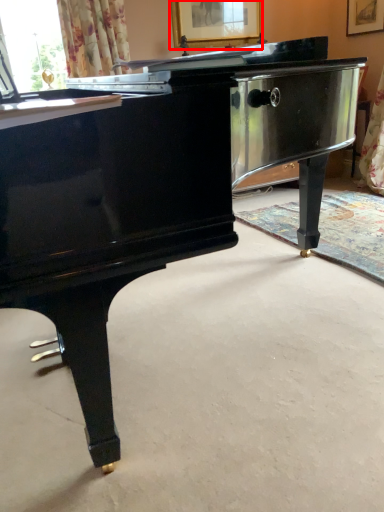
Question: Observing the image, what is the correct spatial positioning of picture frame (annotated by the red box) in reference to flat?

Choices:
 (A) left
 (B) right

Answer: (A)